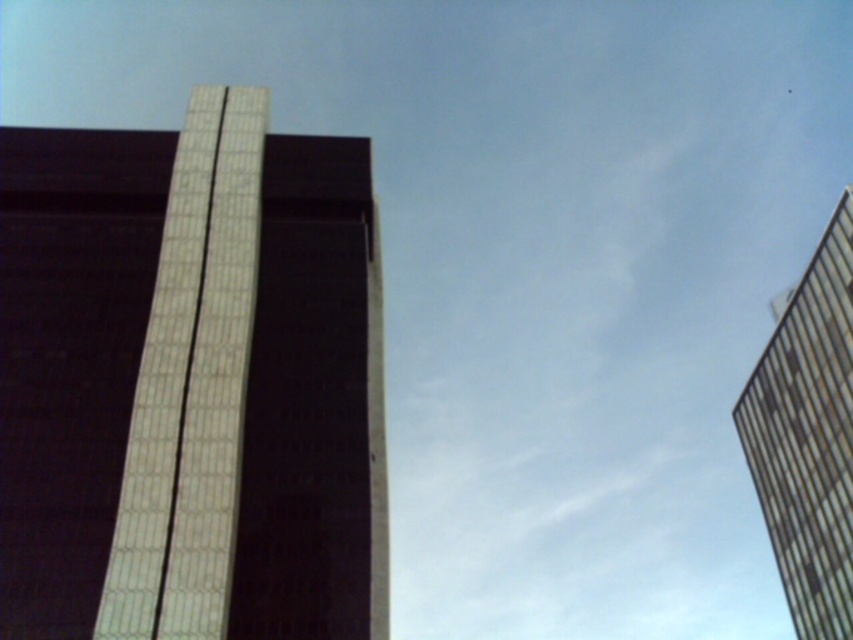
Between white textured building at center and metallic glass tower at right, which one is positioned higher?

white textured building at center

Can you confirm if white textured building at center is smaller than metallic glass tower at right?

Yes.

Is point (73, 147) in front of point (839, 385)?

No.

This screenshot has height=640, width=853. I want to click on white textured building at center, so click(x=190, y=381).